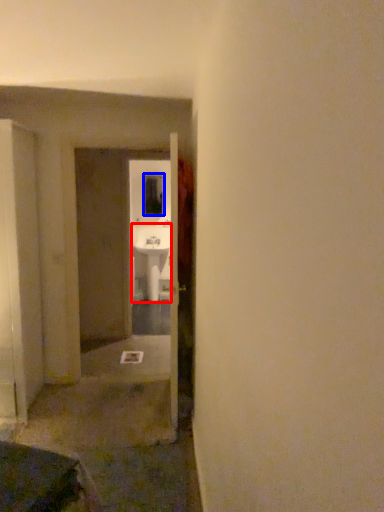
Question: Which object is closer to the camera taking this photo, sink (highlighted by a red box) or window (highlighted by a blue box)?

Choices:
 (A) sink
 (B) window

Answer: (A)